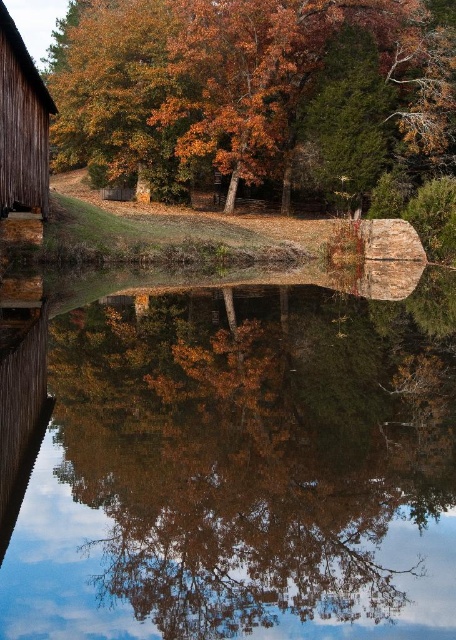
You are standing at the edge of the water in the autumn scene. There is a point marked at coordinates (243, 467). Based on the description, what does this point represent in the scene?

The point at (243, 467) corresponds to the smooth reflective water at center, as stated in the Objects Description.

You are standing at the edge of the water and want to place a small boat exactly between the smooth reflective water at center and the orange autumn leaves at upper center. Which object will the boat be closer to?

The boat will be closer to the smooth reflective water at center because it has a smaller width than the orange autumn leaves at upper center.

Based on the photo, you are standing at the edge of the water and want to locate the orange autumn leaves at upper center. According to the scene description, where exactly would you find them in relation to your position?

The orange autumn leaves at upper center are positioned at coordinates point 0.136 on the x axis and 0.559 on the y axis. Since you are at the edge of the water, they would be located to your upper center direction, slightly to the left and at about 56 percent up from the bottom of the scene.